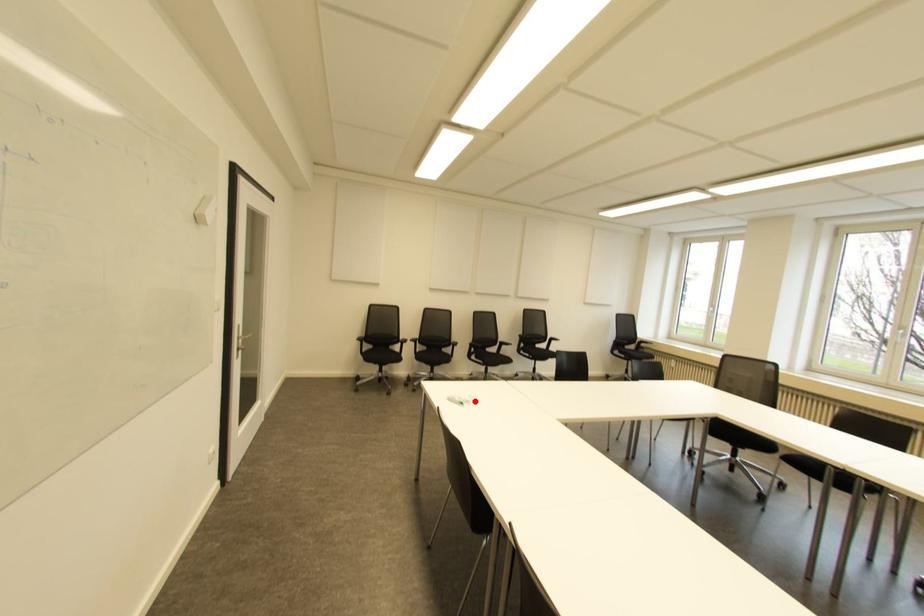
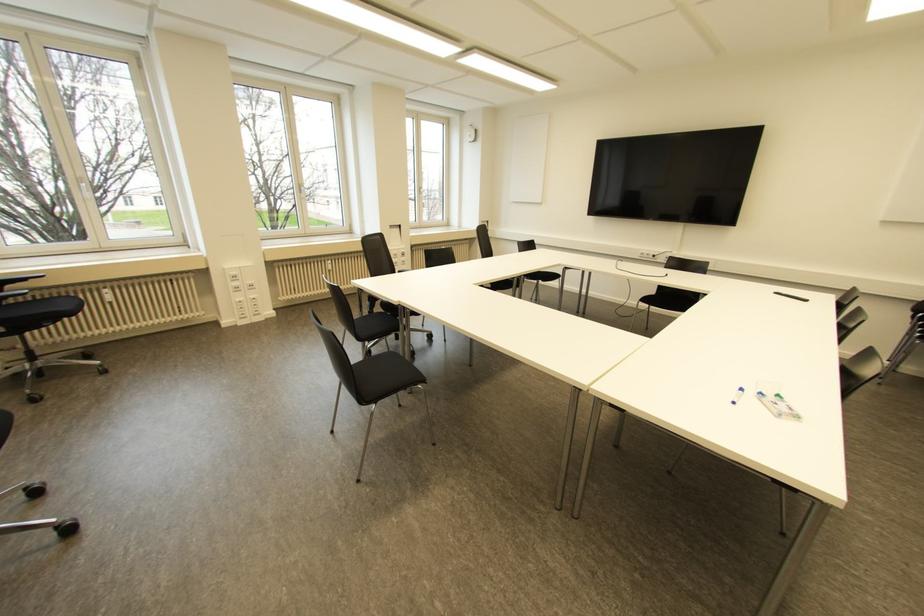
Where in the second image is the point corresponding to the highlighted location from the first image?

(739, 390)